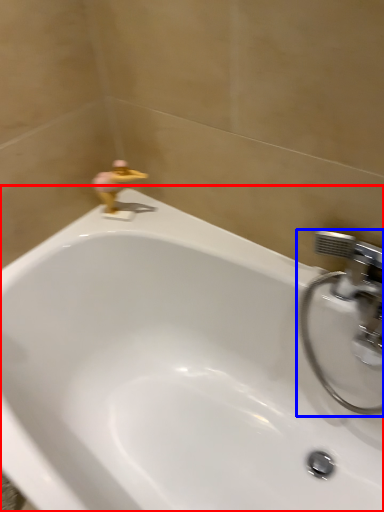
Question: Among these objects, which one is nearest to the camera, bathtub (highlighted by a red box) or tap (highlighted by a blue box)?

Choices:
 (A) bathtub
 (B) tap

Answer: (A)